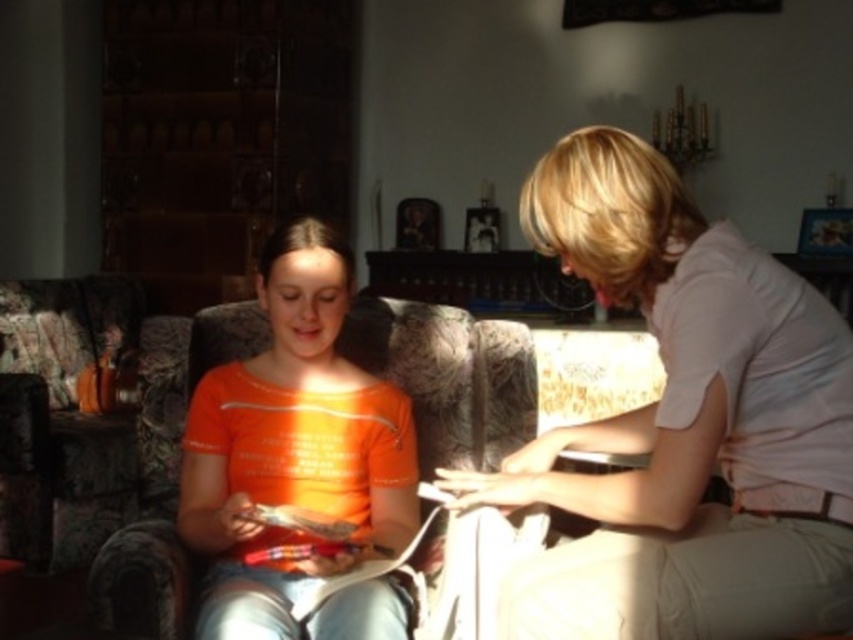
You are a tailor measuring fabrics for a project. You have a piece of fabric that is 1.2 meters wide. You need to decide whether it can cover the light beige cotton shirt at upper right or the textured fabric couch at center. Which object can the fabric cover based on their widths?

The light beige cotton shirt at upper right has a lesser width compared to the textured fabric couch at center. Since the fabric is 1.2 meters wide, it can cover both objects, but the shirt requires less fabric width. However, the question asks which can be covered based on their widths. The fabric is wide enough for both, but since the shirt is narrower, it definitely fits. The couch might also fit depending on its exact width, but the description only states the shirt is narrower. The answer should focus

From the picture: You are a photographer setting up a shoot in the living room. You need to place a small lamp between the orange cotton shirt at center and the textured fabric couch at center. Based on their positions, where should you place the lamp?

The orange cotton shirt at center is positioned on the right side of textured fabric couch at center, so you should place the lamp between them on the right side of the textured fabric couch at center and the left side of the orange cotton shirt at center.

You are a photographer trying to capture a portrait of the light beige cotton shirt at upper right and the textured fabric couch at center. Since you want to ensure both subjects are in focus, you need to know which one is taller. Can you determine which object is taller?

The light beige cotton shirt at upper right is taller than the textured fabric couch at center, so you should adjust your camera settings to focus on the taller object first.